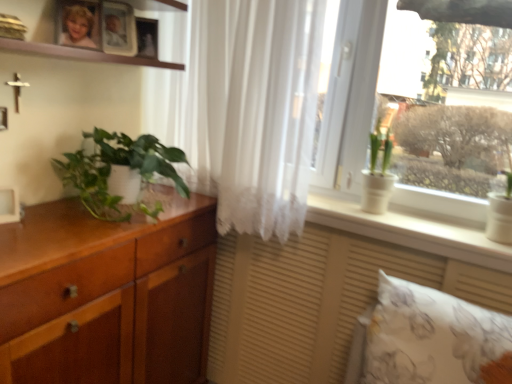
Question: From a real-world perspective, is white sheer curtain at center on top of wooden picture frame at upper center, which is the second picture frame from left to right?

Choices:
 (A) no
 (B) yes

Answer: (A)

Question: Is white sheer curtain at center aimed at wooden picture frame at upper center, which is counted as the 2th picture frame, starting from the right?

Choices:
 (A) no
 (B) yes

Answer: (B)

Question: Can you confirm if white sheer curtain at center is wider than wooden picture frame at upper center, which is the second picture frame from left to right?

Choices:
 (A) yes
 (B) no

Answer: (A)

Question: Is white sheer curtain at center positioned before wooden picture frame at upper center, placed as the second picture frame when sorted from back to front?

Choices:
 (A) no
 (B) yes

Answer: (B)

Question: Is white sheer curtain at center shorter than wooden picture frame at upper center, which is the second picture frame from left to right?

Choices:
 (A) no
 (B) yes

Answer: (A)

Question: Is white sheer curtain at center thinner than wooden picture frame at upper center, acting as the second picture frame starting from the top?

Choices:
 (A) yes
 (B) no

Answer: (B)

Question: Can you confirm if matte wooden picture frame at upper center, which is counted as the 3th picture frame, starting from the bottom, is taller than matte wood vanity at lower center?

Choices:
 (A) yes
 (B) no

Answer: (B)

Question: From the image's perspective, is matte wooden picture frame at upper center, the 1th picture frame when ordered from right to left, over matte wood vanity at lower center?

Choices:
 (A) no
 (B) yes

Answer: (B)

Question: Is matte wooden picture frame at upper center, which is counted as the 3th picture frame, starting from the bottom, behind matte wood vanity at lower center?

Choices:
 (A) yes
 (B) no

Answer: (A)

Question: Is matte wooden picture frame at upper center, which is counted as the 3th picture frame, starting from the bottom, to the right of matte wood vanity at lower center from the viewer's perspective?

Choices:
 (A) yes
 (B) no

Answer: (B)

Question: Are matte wooden picture frame at upper center, which is the 1th picture frame from back to front, and matte wood vanity at lower center far apart?

Choices:
 (A) yes
 (B) no

Answer: (A)

Question: Is matte wooden picture frame at upper center, the first picture frame in the top-to-bottom sequence, aimed at matte wood vanity at lower center?

Choices:
 (A) yes
 (B) no

Answer: (B)

Question: Does white matte picture frame at left, marked as the first picture frame in a front-to-back arrangement, have a smaller size compared to white sheer curtain at center?

Choices:
 (A) no
 (B) yes

Answer: (B)